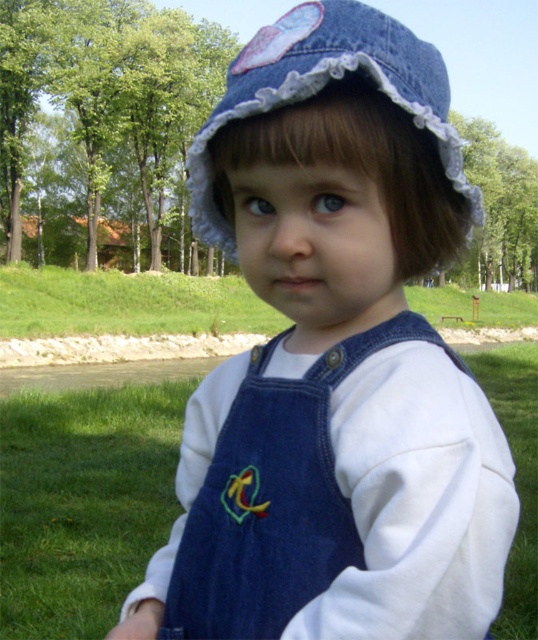
Question: Which point appears farthest from the camera in this image?

Choices:
 (A) (23, 508)
 (B) (329, 54)

Answer: (A)

Question: From the image, what is the correct spatial relationship of green grass at lower left in relation to denim hat at center?

Choices:
 (A) right
 (B) left

Answer: (A)

Question: Observing the image, what is the correct spatial positioning of green grass at lower left in reference to denim hat at center?

Choices:
 (A) below
 (B) above

Answer: (A)

Question: Among these objects, which one is nearest to the camera?

Choices:
 (A) denim hat at center
 (B) green grass at lower left

Answer: (A)

Question: Does green grass at lower left have a lesser width compared to denim hat at center?

Choices:
 (A) no
 (B) yes

Answer: (A)